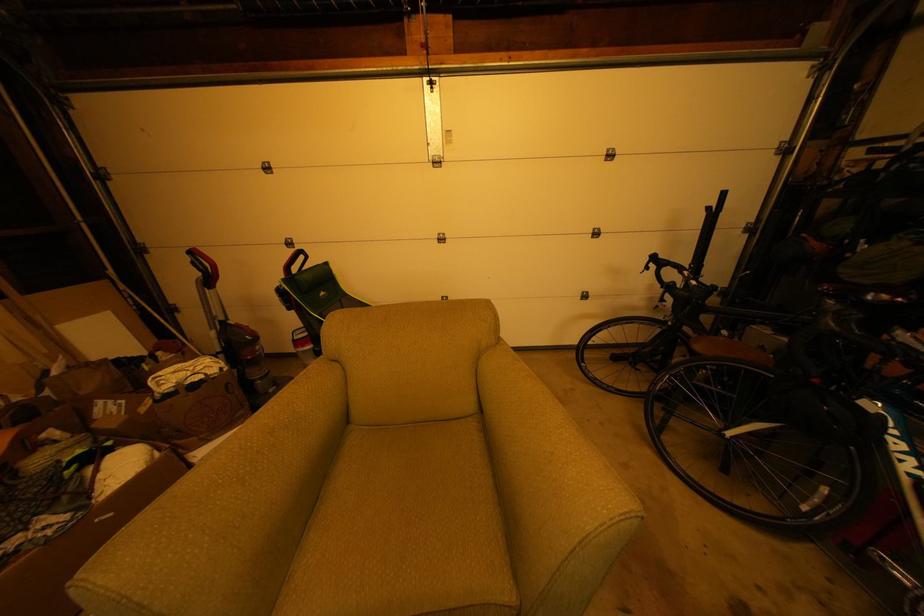
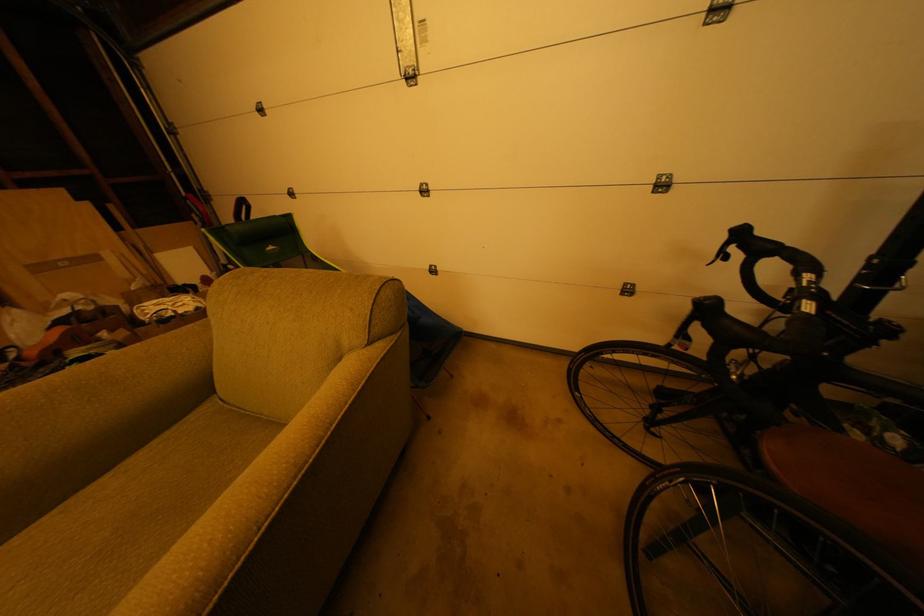
Question: The camera is either moving clockwise (left) or counter-clockwise (right) around the object. The first image is from the beginning of the video and the second image is from the end. Is the camera moving left or right when shooting the video?

Choices:
 (A) Left
 (B) Right

Answer: (B)